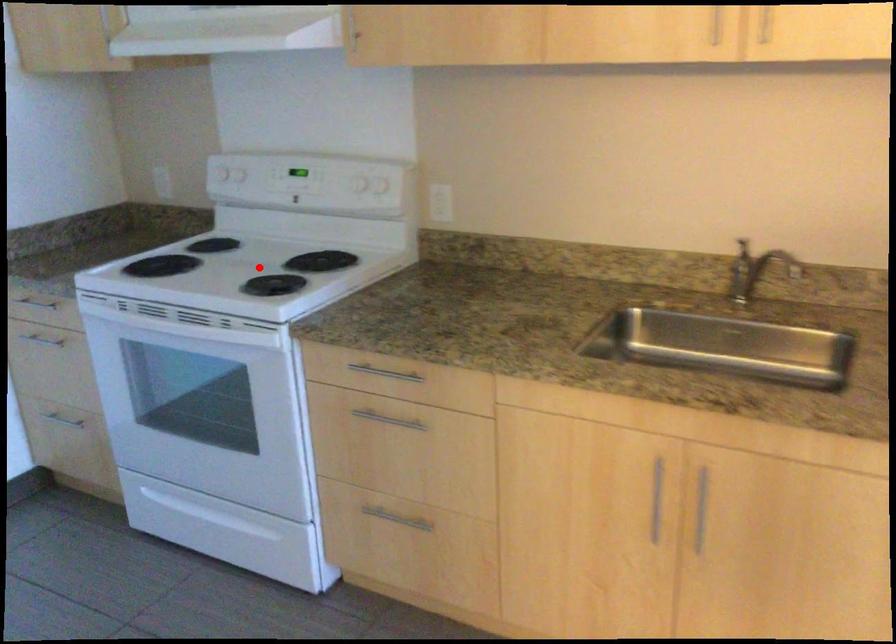
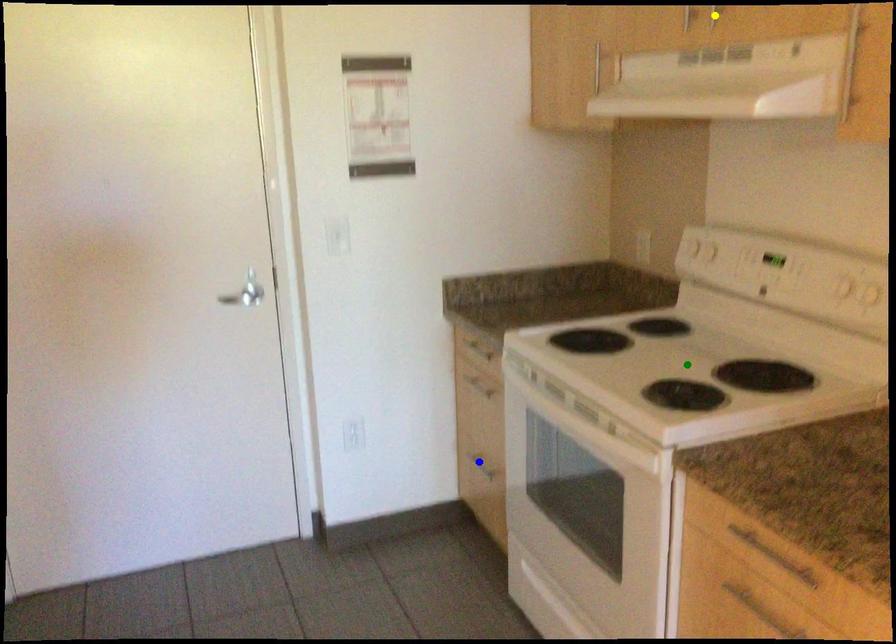
Question: I am providing you with two images of the same scene from different viewpoints. A red point is marked on the first image. You are given multiple points on the second image. Can you choose the point in image 2 that corresponds to the point in image 1?

Choices:
 (A) green point
 (B) blue point
 (C) yellow point

Answer: (A)